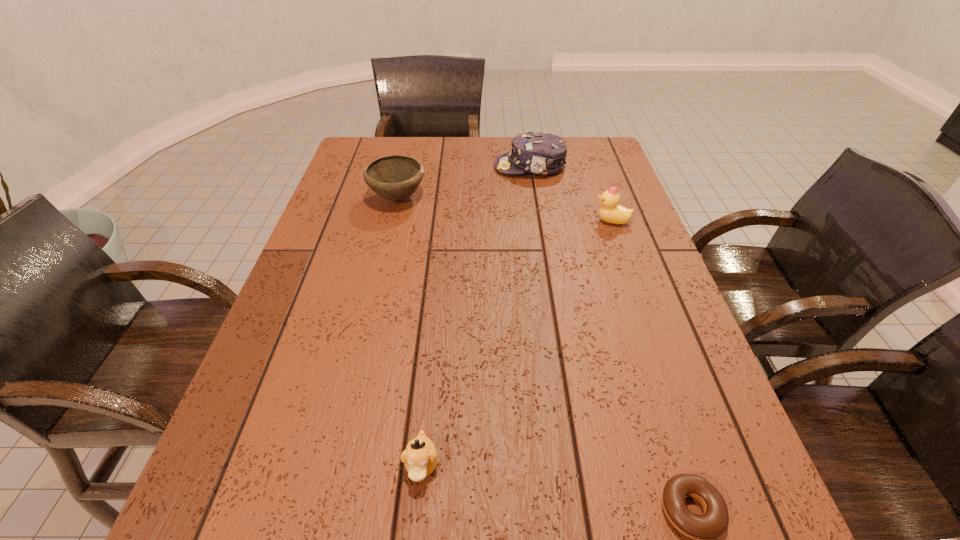
Locate an element on the screen. Image resolution: width=960 pixels, height=540 pixels. free space between the farther duckling and the farthest object is located at coordinates (571, 194).

Point out which object is positioned as the third nearest to the nearer duckling. Please provide its 2D coordinates. Your answer should be formatted as a tuple, i.e. [(x, y)], where the tuple contains the x and y coordinates of a point satisfying the conditions above.

[(611, 212)]

Identify which object is the third nearest to the bowl. Please provide its 2D coordinates. Your answer should be formatted as a tuple, i.e. [(x, y)], where the tuple contains the x and y coordinates of a point satisfying the conditions above.

[(420, 457)]

Where is `free space that satisfies the following two spatial constraints: 1. on the front-facing side of the farther duckling; 2. on the face of the nearer duckling`? This screenshot has height=540, width=960. free space that satisfies the following two spatial constraints: 1. on the front-facing side of the farther duckling; 2. on the face of the nearer duckling is located at coordinates (698, 465).